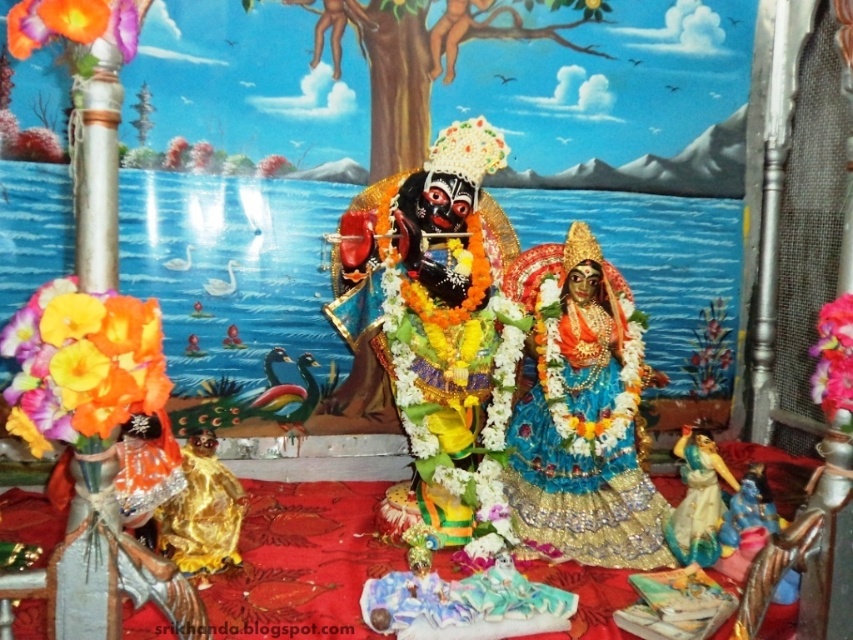
Question: Which object appears closest to the camera in this image?

Choices:
 (A) orange fabric flower at upper left
 (B) blue silk saree at center
 (C) floral garland at center

Answer: (A)

Question: Can you confirm if blue silk saree at center is smaller than matte orange flower at left?

Choices:
 (A) yes
 (B) no

Answer: (B)

Question: Does orange fabric flower at upper left have a smaller size compared to floral garland at center?

Choices:
 (A) no
 (B) yes

Answer: (B)

Question: Among these points, which one is farthest from the camera?

Choices:
 (A) (822, 372)
 (B) (490, 444)
 (C) (10, 32)
 (D) (614, 563)

Answer: (B)

Question: Can you confirm if blue silk saree at center is positioned below matte orange flower at left?

Choices:
 (A) yes
 (B) no

Answer: (A)

Question: Which of the following is the farthest from the observer?

Choices:
 (A) orange fabric flower at upper left
 (B) polished gold statue at center
 (C) floral garland at center

Answer: (B)